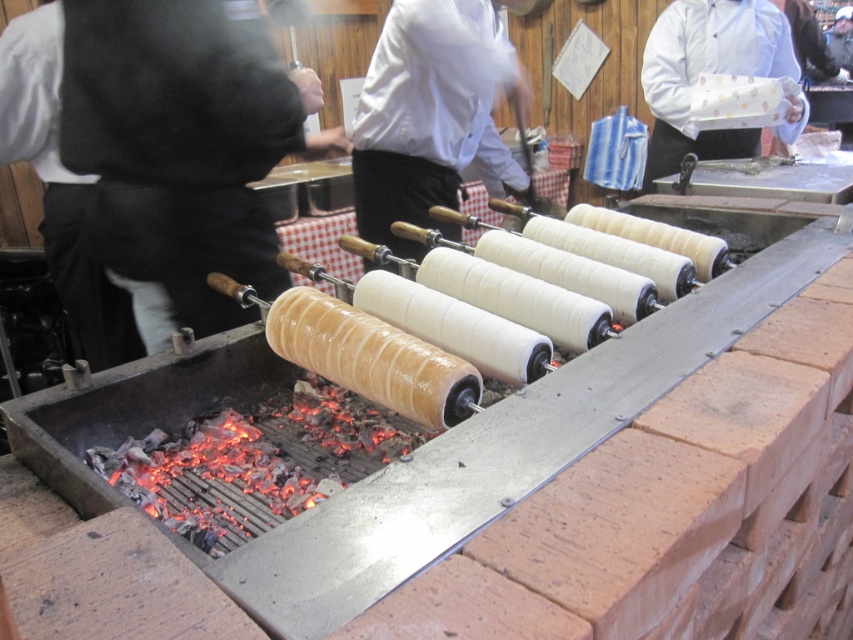
You are a food safety inspector visiting this market stall. You need to locate the chef responsible for the trdelnik cooking process. According to the scene description, where should you look to find the chef wearing the white glossy chef coat at center?

The chef wearing the white glossy chef coat at center is located at point (431, 116).

You are standing at the point marked as point (514, 192) and want to take a photo of the trdelnik cooking on the grill. Since you know the distance from the camera to this point is 2.80 meters, will you need to adjust your camera focus to capture the trdelnik clearly?

The distance of point (514, 192) from camera is 2.80 meters, so you need to adjust your camera focus to that distance to capture the trdelnik clearly.

You are a food critic standing at the entrance of the market stall. You want to take a photo of the white glossy chef coat at center without moving your position. Is the camera within reach to capture the coat in the frame?

The white glossy chef coat at center and camera are 6.12 feet apart. Since the camera is 6.12 feet away from the coat, it is within a reasonable distance for a food critic to capture the coat in the frame without needing to move closer.